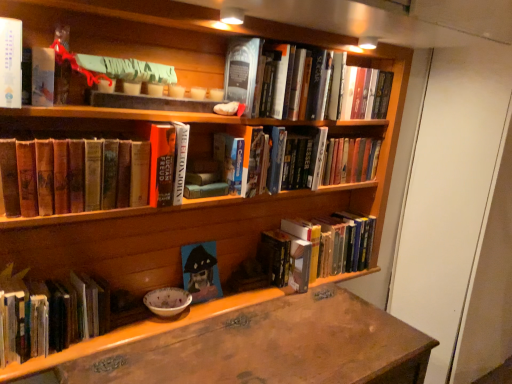
This screenshot has height=384, width=512. In order to click on hardcover book at lower right, which is the first book from right to left in this screenshot , I will do `click(324, 245)`.

Locate an element on the screen. hardcover book at lower left, which is the 7th book from right to left is located at coordinates (49, 314).

Describe the element at coordinates (90, 174) in the screenshot. I see `brown leather book at lower left, which is counted as the second book, starting from the left` at that location.

You are a GUI agent. You are given a task and a screenshot of the screen. Output one action in this format:
    pyautogui.click(x=<x>, y=<y>)
    Task: Click on the hardcover book at center, placed as the fourth book when sorted from left to right
    
    Given the screenshot: What is the action you would take?
    pyautogui.click(x=168, y=163)

Locate an element on the screen. Image resolution: width=512 pixels, height=384 pixels. wooden desk at lower center is located at coordinates (268, 347).

Between brown leather book at lower left, which is counted as the second book, starting from the left, and hardcover book at lower right, which is the first book from right to left, which one has larger width?

With larger width is hardcover book at lower right, which is the first book from right to left.

From a real-world perspective, is brown leather book at lower left, the 6th book from the right, positioned above or below hardcover book at lower right, which is the first book from right to left?

From a real-world perspective, brown leather book at lower left, the 6th book from the right, is physically above hardcover book at lower right, which is the first book from right to left.

Is brown leather book at lower left, which is counted as the second book, starting from the left, with hardcover book at lower right, which is the first book from right to left?

They are not placed beside each other.

Which point is more distant from viewer, [321,288] or [122,146]?

The point [321,288] is more distant.

From a real-world perspective, is wooden desk at lower center over brown leather book at lower left, which is counted as the second book, starting from the left?

No.

From the image's perspective, between wooden desk at lower center and brown leather book at lower left, the 6th book from the right, who is located below?

From the image's view, wooden desk at lower center is below.

Based on their sizes in the image, would you say brown leather book at lower left, which is counted as the second book, starting from the left, is bigger or smaller than wooden desk at lower center?

brown leather book at lower left, which is counted as the second book, starting from the left, is smaller than wooden desk at lower center.

From a real-world perspective, is brown leather book at lower left, which is counted as the second book, starting from the left, positioned above or below wooden desk at lower center?

brown leather book at lower left, which is counted as the second book, starting from the left, is situated higher than wooden desk at lower center in the real world.

Is brown leather book at lower left, which is counted as the second book, starting from the left, to the right of wooden desk at lower center from the viewer's perspective?

No.

Can you confirm if brown leather book at lower left, the 6th book from the right, is thinner than wooden desk at lower center?

Yes.

Which is closer, [102,67] or [74,302]?

Point [102,67] appears to be closer to the viewer than point [74,302].

Which object is more forward, green paper sign at upper center, the third book positioned from the left, or hardcover book at lower left, the first book when ordered from left to right?

hardcover book at lower left, the first book when ordered from left to right, is closer to the camera.

How many degrees apart are the facing directions of green paper sign at upper center, which appears as the fifth book when viewed from the right, and hardcover book at lower left, the first book when ordered from left to right?

The facing directions of green paper sign at upper center, which appears as the fifth book when viewed from the right, and hardcover book at lower left, the first book when ordered from left to right, are 0.000784 degrees apart.

There is a green paper sign at upper center, which appears as the fifth book when viewed from the right. Where is `the 5th book below it (from a real-world perspective)`? The height and width of the screenshot is (384, 512). the 5th book below it (from a real-world perspective) is located at coordinates (49, 314).

In the image, is matte blue canvas painting at center, the third book positioned from the right, positioned in front of or behind wooden desk at lower center?

matte blue canvas painting at center, the third book positioned from the right, is positioned farther from the viewer than wooden desk at lower center.

From a real-world perspective, is matte blue canvas painting at center, the third book positioned from the right, located higher than wooden desk at lower center?

Yes, from a real-world perspective, matte blue canvas painting at center, the third book positioned from the right, is above wooden desk at lower center.

Visually, is matte blue canvas painting at center, the third book positioned from the right, positioned to the left or to the right of wooden desk at lower center?

From the image, it's evident that matte blue canvas painting at center, the third book positioned from the right, is to the left of wooden desk at lower center.

Could you tell me if matte blue canvas painting at center, which appears as the 5th book when viewed from the left, is turned towards wooden desk at lower center?

No, matte blue canvas painting at center, which appears as the 5th book when viewed from the left, is not oriented towards wooden desk at lower center.

Starting from the hardcover book at center, marked as the 4th book in a right-to-left arrangement, which book is the 2nd one behind? Please provide its 2D coordinates.

[(201, 271)]

Does hardcover book at center, marked as the 4th book in a right-to-left arrangement, turn towards matte blue canvas painting at center, which appears as the 5th book when viewed from the left?

No, hardcover book at center, marked as the 4th book in a right-to-left arrangement, is not oriented towards matte blue canvas painting at center, which appears as the 5th book when viewed from the left.

Considering the relative sizes of hardcover book at center, marked as the 4th book in a right-to-left arrangement, and matte blue canvas painting at center, the third book positioned from the right, in the image provided, is hardcover book at center, marked as the 4th book in a right-to-left arrangement, thinner than matte blue canvas painting at center, the third book positioned from the right,?

No.

Is point (21, 179) closer or farther from the camera than point (159, 186)?

Point (21, 179) is closer to the camera than point (159, 186).

Does brown leather book at lower left, which is counted as the second book, starting from the left, appear on the right side of hardcover book at center, marked as the 4th book in a right-to-left arrangement?

In fact, brown leather book at lower left, which is counted as the second book, starting from the left, is to the left of hardcover book at center, marked as the 4th book in a right-to-left arrangement.

From the image's perspective, would you say brown leather book at lower left, which is counted as the second book, starting from the left, is positioned over hardcover book at center, placed as the fourth book when sorted from left to right?

No, from the image's perspective, brown leather book at lower left, which is counted as the second book, starting from the left, is not above hardcover book at center, placed as the fourth book when sorted from left to right.

Is brown leather book at lower left, the 6th book from the right, oriented towards hardcover book at center, placed as the fourth book when sorted from left to right?

No, brown leather book at lower left, the 6th book from the right, is not aimed at hardcover book at center, placed as the fourth book when sorted from left to right.

There is a hardcover book at lower right, which is the first book from right to left. Identify the location of the 2nd book above it (from a real-world perspective). (90, 174).

At what (x,y) coordinates should I click in order to perform the action: click on desk below the brown leather book at lower left, the 6th book from the right (from a real-world perspective). Please return your answer as a coordinate pair (x, y). This screenshot has height=384, width=512. Looking at the image, I should click on (268, 347).

From the image, which object appears to be nearer to brown leather book at lower left, which is counted as the second book, starting from the left, matte blue canvas painting at center, which appears as the 5th book when viewed from the left, or wooden desk at lower center?

matte blue canvas painting at center, which appears as the 5th book when viewed from the left, lies closer to brown leather book at lower left, which is counted as the second book, starting from the left, than the other object.

Looking at the image, which one is located closer to hardcover book at center, marked as the 4th book in a right-to-left arrangement, matte blue canvas painting at center, which appears as the 5th book when viewed from the left, or hardcover book at upper center, marked as the 6th book in a left-to-right arrangement?

matte blue canvas painting at center, which appears as the 5th book when viewed from the left.

Considering their positions, is brown leather book at lower left, the 6th book from the right, positioned closer to matte blue canvas painting at center, the third book positioned from the right, than hardcover book at center, marked as the 4th book in a right-to-left arrangement?

hardcover book at center, marked as the 4th book in a right-to-left arrangement, lies closer to matte blue canvas painting at center, the third book positioned from the right, than the other object.

Estimate the real-world distances between objects in this image. Which object is closer to brown leather book at lower left, the 6th book from the right, hardcover book at center, placed as the fourth book when sorted from left to right, or hardcover book at lower right, which is the first book from right to left?

hardcover book at center, placed as the fourth book when sorted from left to right.

Based on their spatial positions, is matte blue canvas painting at center, which appears as the 5th book when viewed from the left, or brown leather book at lower left, which is counted as the second book, starting from the left, further from hardcover book at upper center, the 2th book from the right?

matte blue canvas painting at center, which appears as the 5th book when viewed from the left.

In the scene shown: When comparing their distances from wooden desk at lower center, does matte blue canvas painting at center, the third book positioned from the right, or brown leather book at lower left, the 6th book from the right, seem further?

brown leather book at lower left, the 6th book from the right, is positioned further to the anchor wooden desk at lower center.

From the image, which object appears to be nearer to hardcover book at upper center, marked as the 6th book in a left-to-right arrangement, hardcover book at center, marked as the 4th book in a right-to-left arrangement, or green paper sign at upper center, the third book positioned from the left?

hardcover book at center, marked as the 4th book in a right-to-left arrangement, is closer to hardcover book at upper center, marked as the 6th book in a left-to-right arrangement.

Looking at the image, which one is located closer to hardcover book at upper center, the 2th book from the right, brown leather book at lower left, which is counted as the second book, starting from the left, or hardcover book at center, placed as the fourth book when sorted from left to right?

hardcover book at center, placed as the fourth book when sorted from left to right.

Find the location of a particular element. The height and width of the screenshot is (384, 512). book between green paper sign at upper center, which appears as the fifth book when viewed from the right, and brown leather book at lower left, the 6th book from the right, from top to bottom is located at coordinates (168, 163).